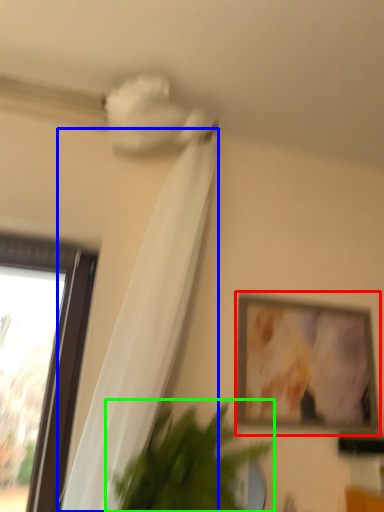
Question: Which object is the closest to the picture frame (highlighted by a red box)? Choose among these: curtain (highlighted by a blue box) or houseplant (highlighted by a green box).

Choices:
 (A) curtain
 (B) houseplant

Answer: (B)